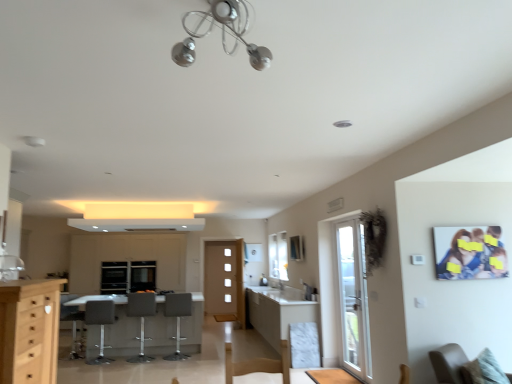
Question: From the image's perspective, is light wood cabinet at left, the second cabinetry from the left, over matte gray bar stool at center, which is the first armchair in right-to-left order?

Choices:
 (A) no
 (B) yes

Answer: (B)

Question: Does light wood cabinet at left, the second cabinetry from the left, have a lesser width compared to matte gray bar stool at center, acting as the fourth armchair starting from the left?

Choices:
 (A) no
 (B) yes

Answer: (B)

Question: Is light wood cabinet at left, marked as the 3th cabinetry in a back-to-front arrangement, to the right of matte gray bar stool at center, acting as the fourth armchair starting from the left, from the viewer's perspective?

Choices:
 (A) yes
 (B) no

Answer: (B)

Question: Is light wood cabinet at left, the second cabinetry from the left, oriented towards matte gray bar stool at center, which is the first armchair in right-to-left order?

Choices:
 (A) yes
 (B) no

Answer: (B)

Question: Is there a large distance between light wood cabinet at left, the 2th cabinetry from the right, and matte gray bar stool at center, acting as the fourth armchair starting from the left?

Choices:
 (A) no
 (B) yes

Answer: (B)

Question: Would you say black glass window screen at center is inside or outside gray fabric armchair at lower left, which appears as the fourth armchair when viewed from the right?

Choices:
 (A) inside
 (B) outside

Answer: (B)

Question: From their relative heights in the image, would you say black glass window screen at center is taller or shorter than gray fabric armchair at lower left, arranged as the 1th armchair when viewed from the left?

Choices:
 (A) tall
 (B) short

Answer: (B)

Question: Is black glass window screen at center in front of or behind gray fabric armchair at lower left, which appears as the fourth armchair when viewed from the right, in the image?

Choices:
 (A) behind
 (B) front

Answer: (A)

Question: Considering the positions of point (154, 266) and point (61, 296), is point (154, 266) closer or farther from the camera than point (61, 296)?

Choices:
 (A) closer
 (B) farther

Answer: (B)

Question: Is metallic chrome chandelier at upper center bigger or smaller than matte white cabinetry at center, which ranks as the third cabinetry in front-to-back order?

Choices:
 (A) small
 (B) big

Answer: (A)

Question: From the image's perspective, is metallic chrome chandelier at upper center located above or below matte white cabinetry at center, which is the first cabinetry from back to front?

Choices:
 (A) above
 (B) below

Answer: (A)

Question: From a real-world perspective, is metallic chrome chandelier at upper center positioned above or below matte white cabinetry at center, which ranks as the third cabinetry in front-to-back order?

Choices:
 (A) below
 (B) above

Answer: (B)

Question: Choose the correct answer: Is metallic chrome chandelier at upper center inside matte white cabinetry at center, the 1th cabinetry from the left, or outside it?

Choices:
 (A) outside
 (B) inside

Answer: (A)

Question: Based on their positions, is beige fabric chair at lower right located to the left or right of black glass window screen at center?

Choices:
 (A) left
 (B) right

Answer: (B)

Question: Is beige fabric chair at lower right taller or shorter than black glass window screen at center?

Choices:
 (A) short
 (B) tall

Answer: (A)